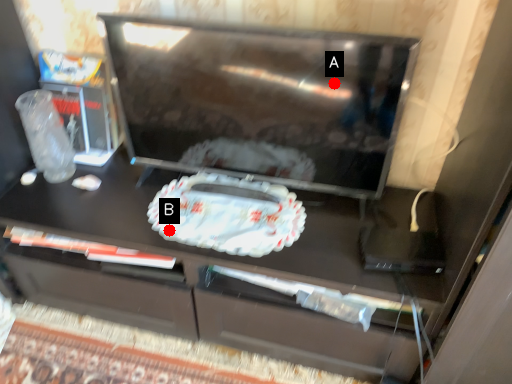
Question: Two points are circled on the image, labeled by A and B beside each circle. Which of the following is the farthest from the observer?

Choices:
 (A) A is further
 (B) B is further

Answer: (B)